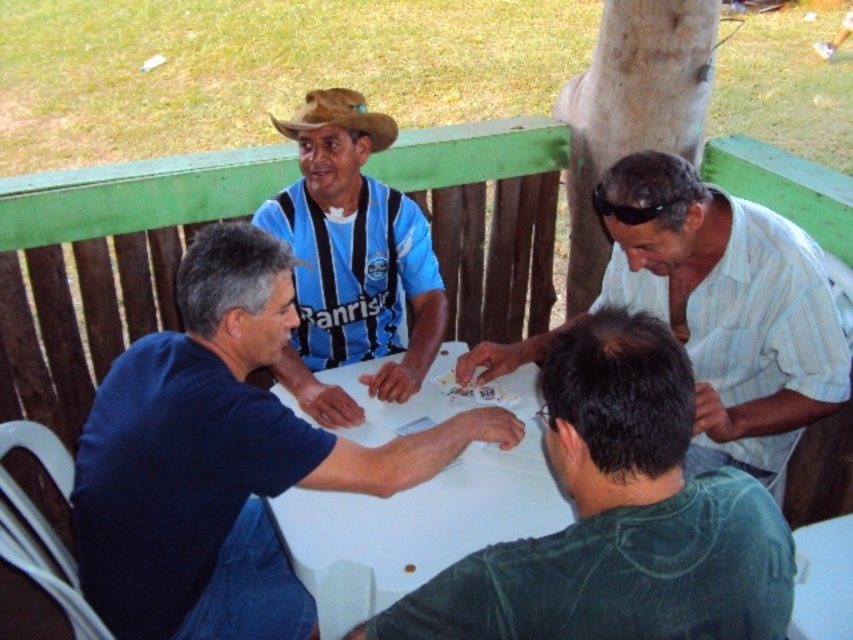
Measure the distance between blue cotton shirt at left and blue jersey at center.

blue cotton shirt at left and blue jersey at center are 18.63 inches apart from each other.

Measure the distance between point (x=277, y=468) and camera.

Point (x=277, y=468) is 5.13 feet from camera.

The height and width of the screenshot is (640, 853). I want to click on blue cotton shirt at left, so click(221, 458).

Is blue jersey at center above white glossy table at center?

A: Yes.

Does point (291, 360) come closer to viewer compared to point (469, 525)?

That is False.

Find the location of `blue jersey at center`. blue jersey at center is located at coordinates (351, 260).

Between blue jersey at center and brown woven cowboy hat at center, which one appears on the right side from the viewer's perspective?

From the viewer's perspective, blue jersey at center appears more on the right side.

Can you confirm if blue jersey at center is thinner than brown woven cowboy hat at center?

No.

Is point (364, 275) positioned before point (318, 109)?

No.

Image resolution: width=853 pixels, height=640 pixels. In order to click on blue jersey at center in this screenshot , I will do `click(351, 260)`.